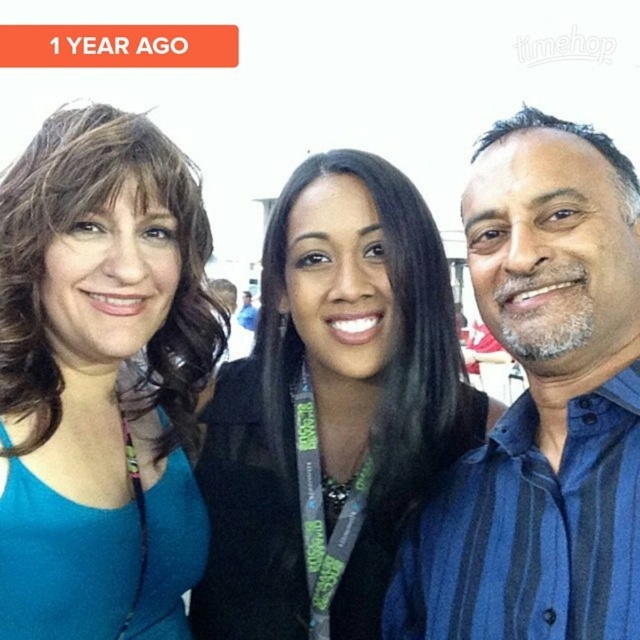
Question: Is black fabric jacket at center further to camera compared to blue striped shirt at center?

Choices:
 (A) yes
 (B) no

Answer: (A)

Question: Which point is closer to the camera?

Choices:
 (A) (211, 456)
 (B) (540, 259)
 (C) (202, 362)

Answer: (B)

Question: From the image, what is the correct spatial relationship of black fabric jacket at center in relation to blue striped shirt at center?

Choices:
 (A) left
 (B) right

Answer: (A)

Question: Which of these objects is positioned farthest from the black fabric jacket at center?

Choices:
 (A) blue striped shirt at center
 (B) matte teal tank top at left

Answer: (B)

Question: Is black fabric jacket at center to the right of matte teal tank top at left from the viewer's perspective?

Choices:
 (A) yes
 (B) no

Answer: (A)

Question: Which point is closer to the camera?

Choices:
 (A) (579, 179)
 (B) (477, 412)

Answer: (A)